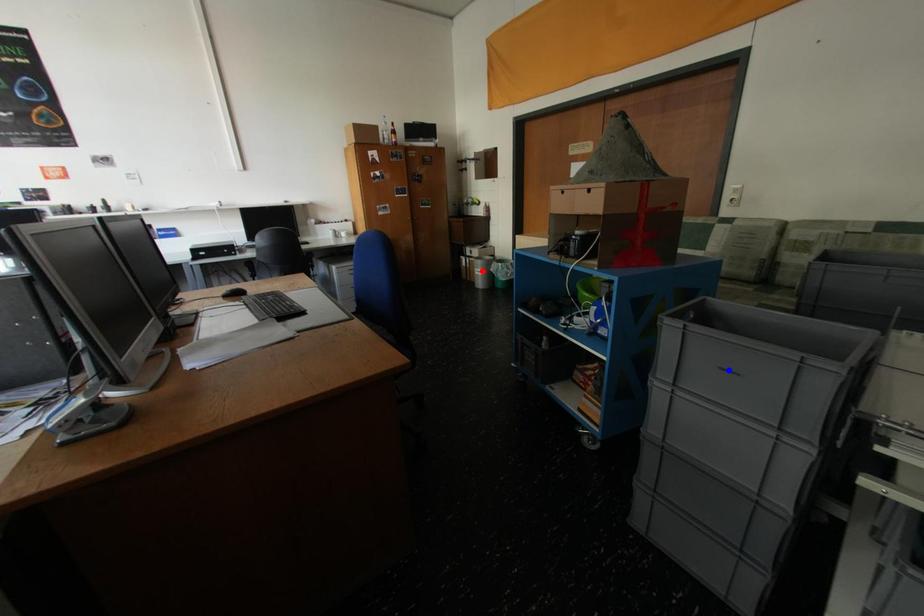
Question: Which of the two points in the image is closer to the camera?

Choices:
 (A) Blue point is closer.
 (B) Red point is closer.

Answer: (A)